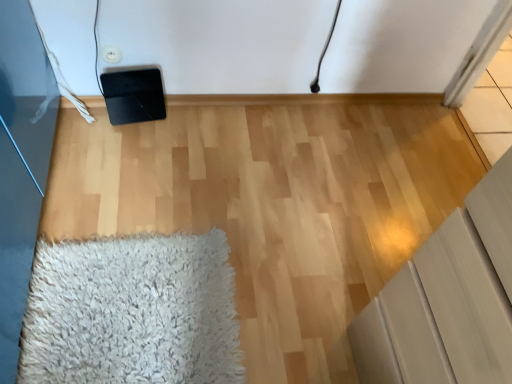
You are a GUI agent. You are given a task and a screenshot of the screen. Output one action in this format:
    pyautogui.click(x=<x>, y=<y>)
    Task: Click on the blank space situated above white shaggy rug at lower left (from a real-world perspective)
    
    Given the screenshot: What is the action you would take?
    pyautogui.click(x=100, y=307)